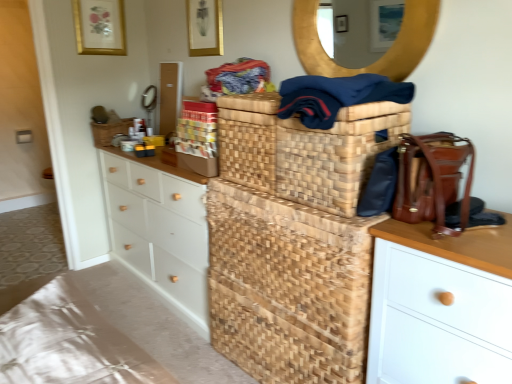
Question: Is matte gold picture frame at upper center, which is counted as the 1th picture frame, starting from the front, to the right of matte gold picture frame at upper center, arranged as the 1th picture frame when viewed from the back, from the viewer's perspective?

Choices:
 (A) yes
 (B) no

Answer: (A)

Question: Does matte gold picture frame at upper center, which is the second picture frame from back to front, have a larger size compared to matte gold picture frame at upper center, positioned as the 2th picture frame in front-to-back order?

Choices:
 (A) yes
 (B) no

Answer: (A)

Question: Considering the relative positions of matte gold picture frame at upper center, acting as the 1th picture frame starting from the right, and matte gold picture frame at upper center, positioned as the 2th picture frame in front-to-back order, in the image provided, is matte gold picture frame at upper center, acting as the 1th picture frame starting from the right, to the left of matte gold picture frame at upper center, positioned as the 2th picture frame in front-to-back order, from the viewer's perspective?

Choices:
 (A) yes
 (B) no

Answer: (B)

Question: Is matte gold picture frame at upper center, which is the second picture frame from back to front, thinner than matte gold picture frame at upper center, positioned as the 2th picture frame in front-to-back order?

Choices:
 (A) yes
 (B) no

Answer: (B)

Question: Would you say matte gold picture frame at upper center, positioned as the 2th picture frame in front-to-back order, is part of matte gold picture frame at upper center, acting as the 1th picture frame starting from the right,'s contents?

Choices:
 (A) no
 (B) yes

Answer: (A)

Question: Looking at their shapes, would you say white matte chest of drawers at left is wider or thinner than matte gold picture frame at upper center, positioned as the second picture frame in right-to-left order?

Choices:
 (A) wide
 (B) thin

Answer: (A)

Question: Is white matte chest of drawers at left inside the boundaries of matte gold picture frame at upper center, positioned as the 2th picture frame in front-to-back order, or outside?

Choices:
 (A) inside
 (B) outside

Answer: (B)

Question: Is white matte chest of drawers at left taller or shorter than matte gold picture frame at upper center, positioned as the 2th picture frame in front-to-back order?

Choices:
 (A) tall
 (B) short

Answer: (A)

Question: From the image's perspective, is white matte chest of drawers at left above or below matte gold picture frame at upper center, positioned as the second picture frame in right-to-left order?

Choices:
 (A) above
 (B) below

Answer: (B)

Question: Looking at the image, does white matte chest of drawers at left seem bigger or smaller compared to natural woven basket at center?

Choices:
 (A) big
 (B) small

Answer: (A)

Question: Is point (162, 203) positioned closer to the camera than point (256, 198)?

Choices:
 (A) closer
 (B) farther

Answer: (B)

Question: Considering the relative positions of white matte chest of drawers at left and natural woven basket at center in the image provided, is white matte chest of drawers at left to the left or to the right of natural woven basket at center?

Choices:
 (A) right
 (B) left

Answer: (B)

Question: From the image's perspective, is white matte chest of drawers at left above or below natural woven basket at center?

Choices:
 (A) above
 (B) below

Answer: (A)

Question: Considering the positions of navy blue fabric at upper center and beige textured fabric at lower left in the image, is navy blue fabric at upper center bigger or smaller than beige textured fabric at lower left?

Choices:
 (A) small
 (B) big

Answer: (A)

Question: In terms of width, does navy blue fabric at upper center look wider or thinner when compared to beige textured fabric at lower left?

Choices:
 (A) wide
 (B) thin

Answer: (B)